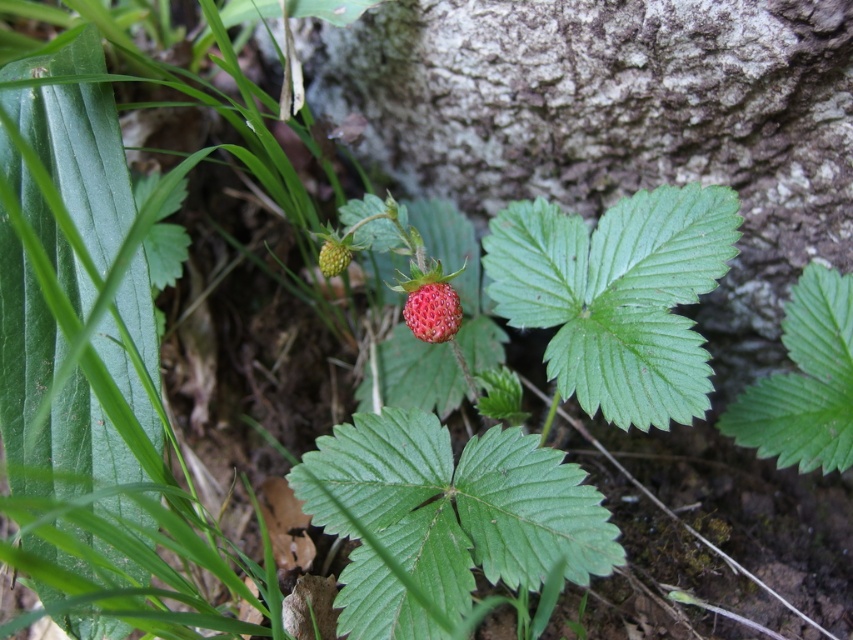
You are a botanist examining the strawberry plant in the forest. You notice two points marked on the image. The first point is at coordinate point (415, 292) and the second is at point (334, 256). Which point is closer to you as you look at the image?

Point (415, 292) is in front of point (334, 256), so the first point is closer to you.

You are a botanist studying strawberry plants in a forest. You observe a glossy red strawberry at center. Can you determine its exact location using the coordinate system provided?

The glossy red strawberry at center is located at coordinate point (432, 310).